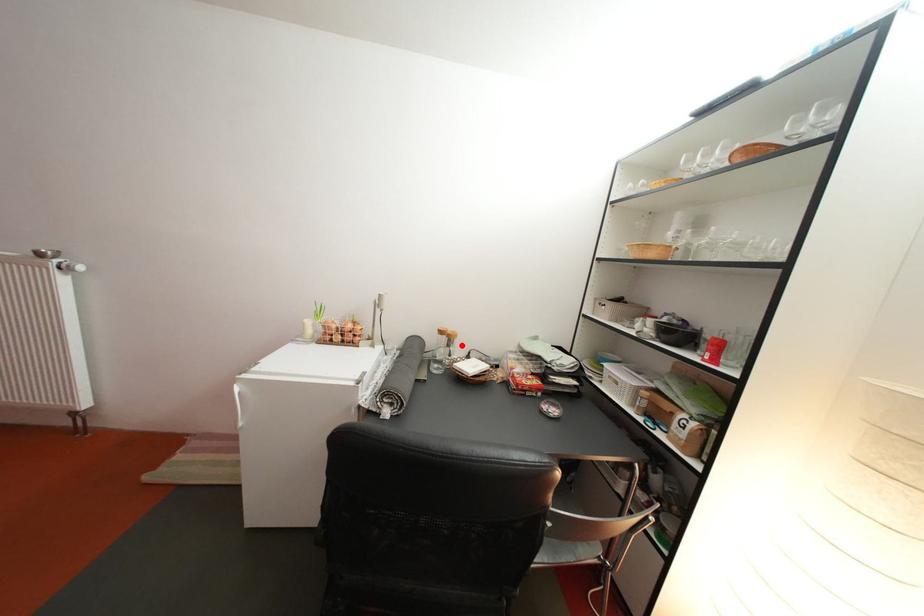
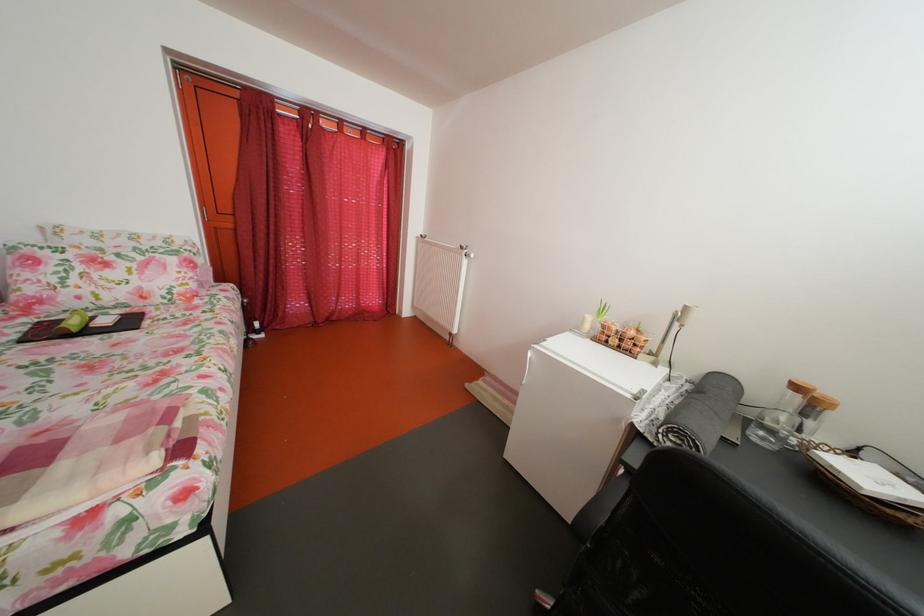
In the second image, find the point that corresponds to the highlighted location in the first image.

(824, 411)